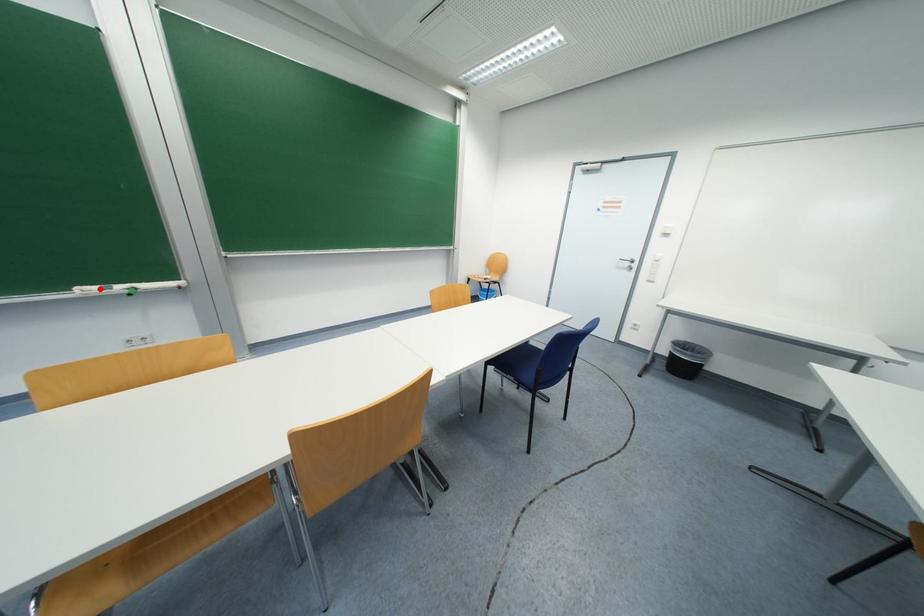
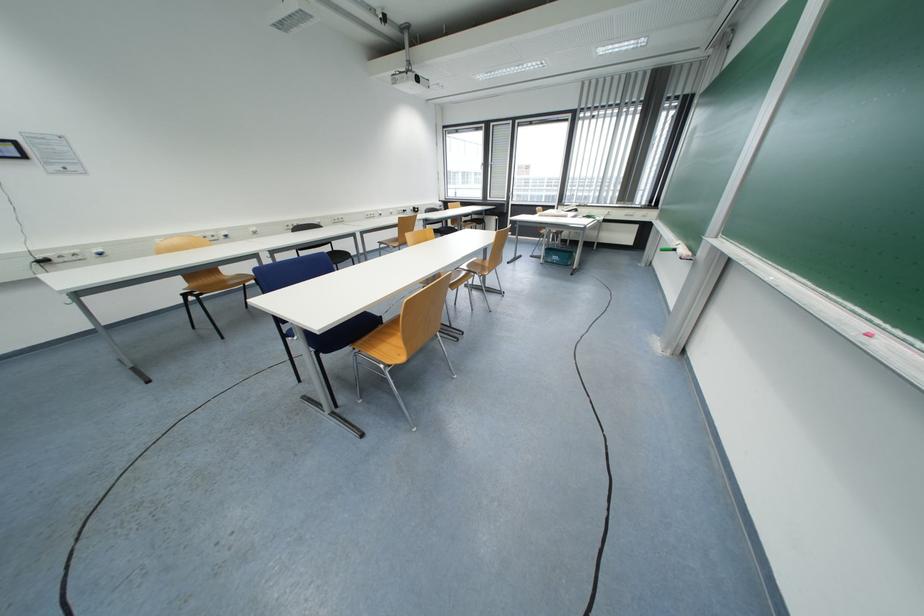
In the second image, find the point that corresponds to the highlighted location in the first image.

(683, 244)